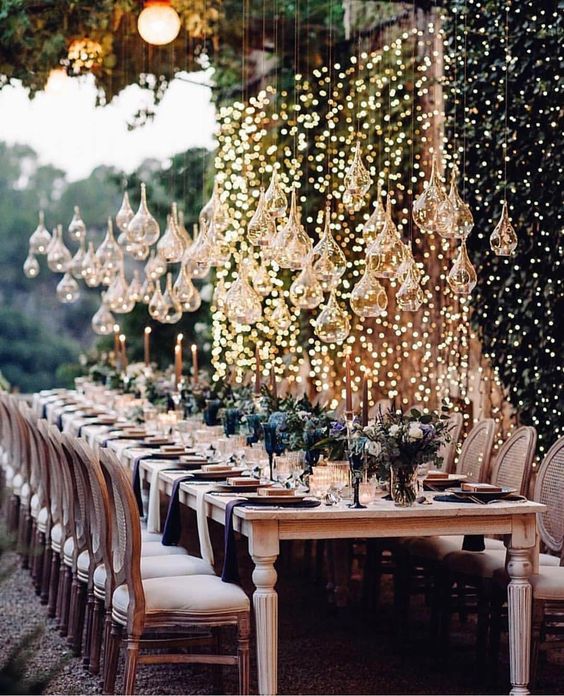
Image resolution: width=564 pixels, height=696 pixels. Identify the location of white napkin. (201, 507), (152, 479).